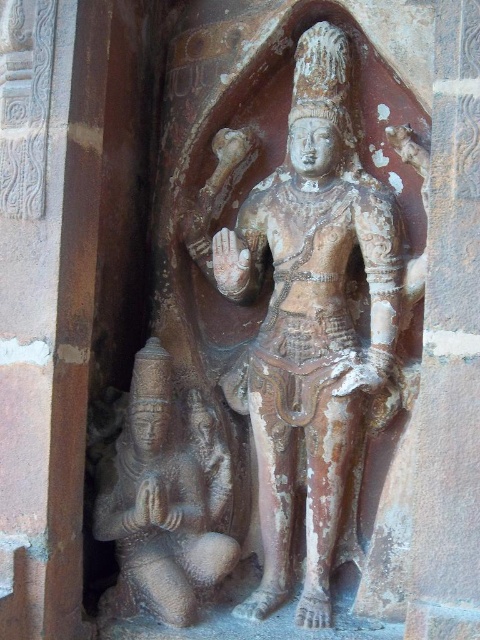
Is brown stone statue at center above rusty stone statue at lower left?

Yes, brown stone statue at center is above rusty stone statue at lower left.

Based on the photo, who is lower down, brown stone statue at center or rusty stone statue at lower left?

rusty stone statue at lower left is below.

Does point (292, 484) come farther from viewer compared to point (143, 524)?

Yes.

Where is `brown stone statue at center`? This screenshot has height=640, width=480. brown stone statue at center is located at coordinates (314, 323).